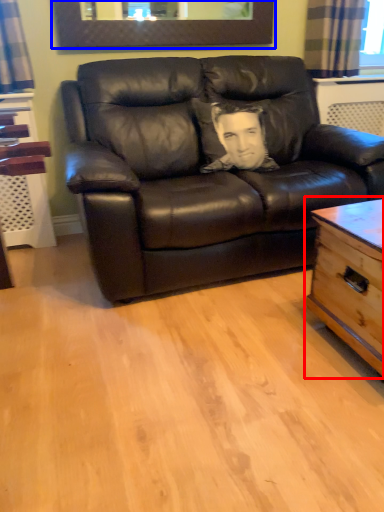
Question: Which object is closer to the camera taking this photo, table (highlighted by a red box) or picture frame (highlighted by a blue box)?

Choices:
 (A) table
 (B) picture frame

Answer: (A)